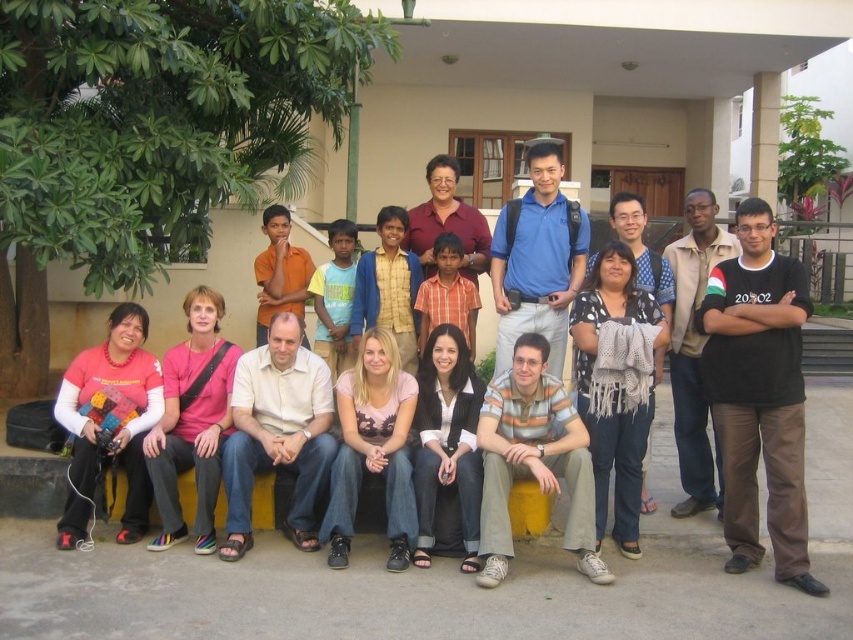
You are taking a photo of the group and need to focus on two specific points in the image. The first point is at coordinate point [131,440] and the second is at point [631,262]. Which point should you focus on to ensure both are in focus if your camera has a limited depth of field?

You should focus on point [631,262] because it is closer to the camera than point [131,440]. By focusing on the closer point, the farther point will still be within the depth of field range.

In the scene shown: Where is the matte black jacket at center located in the image?

The matte black jacket at center is located at point coordinates of (447, 440).

You are standing in front of the building and notice two items at the center of the group. Which item is positioned to the left when looking at the matte black jacket at center and knitted gray scarf at center?

The matte black jacket at center is positioned to the left of the knitted gray scarf at center.